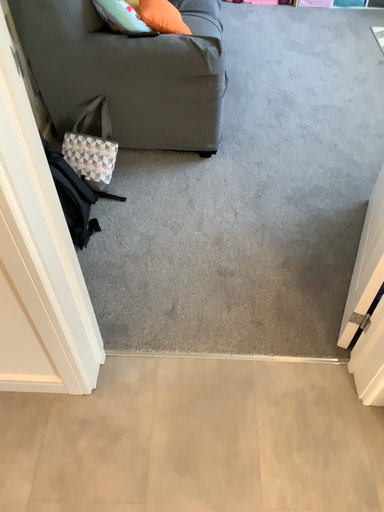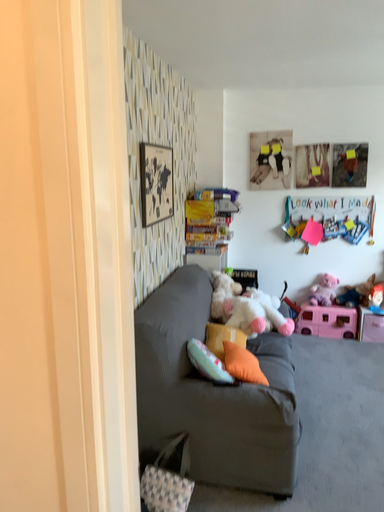
Question: How did the camera likely rotate when shooting the video?

Choices:
 (A) rotated downward
 (B) rotated upward

Answer: (B)